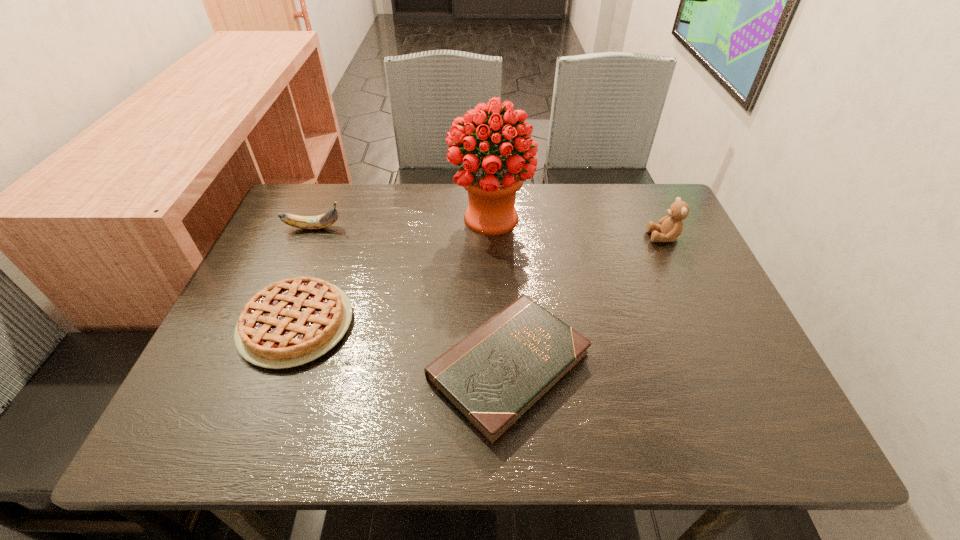
Identify the location of object at the far left corner. The image size is (960, 540). (321, 221).

You are a GUI agent. You are given a task and a screenshot of the screen. Output one action in this format:
    pyautogui.click(x=<x>, y=<y>)
    Task: Click on the object present at the far right corner
    The width and height of the screenshot is (960, 540).
    Given the screenshot: What is the action you would take?
    pyautogui.click(x=670, y=227)

I want to click on free location at the far edge, so click(x=599, y=207).

At what (x,y) coordinates should I click in order to perform the action: click on vacant space at the near edge of the desktop. Please return your answer as a coordinate pair (x, y). Looking at the image, I should click on (445, 437).

The height and width of the screenshot is (540, 960). I want to click on free space at the left edge of the desktop, so click(219, 392).

This screenshot has height=540, width=960. What are the coordinates of `vacant space at the right edge of the desktop` in the screenshot? It's located at (676, 306).

Where is `free space at the near left corner`? The height and width of the screenshot is (540, 960). free space at the near left corner is located at coordinates (212, 431).

The image size is (960, 540). In the image, there is a desktop. In order to click on vacant space at the far right corner in this screenshot , I will do `click(664, 197)`.

This screenshot has height=540, width=960. I want to click on free point between the Bible and the tallest object, so click(x=499, y=293).

Find the location of a particular element. vacant area that lies between the Bible and the bouquet is located at coordinates (499, 293).